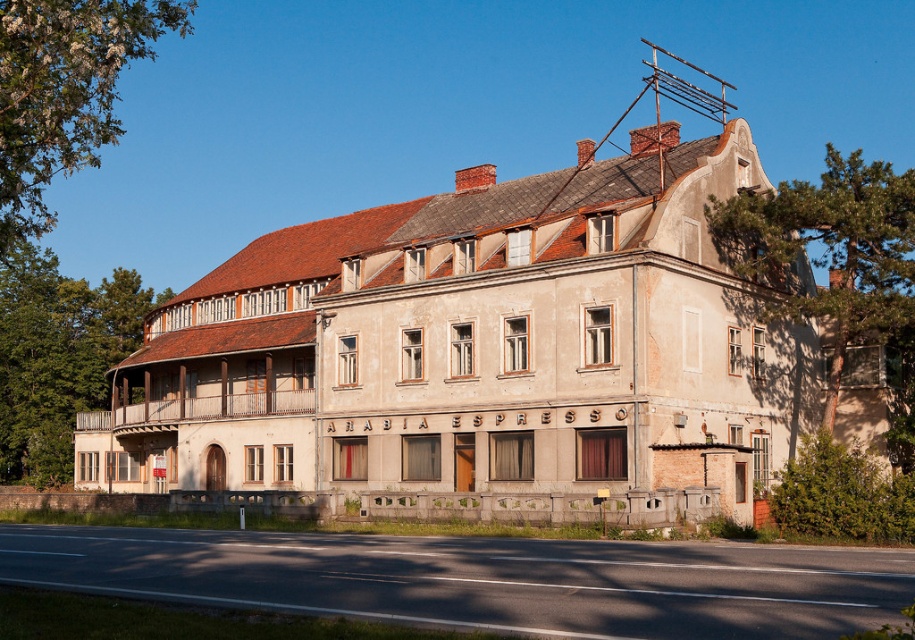
You are standing at the entrance of the ARABIA ESPRESSO on the ground floor. Looking up, you see a point marked at coordinates (835, 262). What object does this point correspond to?

The point at coordinates 0.414, 0.914 corresponds to the green leafy tree at upper right.

You are a customer at the ARABIA ESPRESSO and want to take a photo of the building with both green leafy tree at upper right and green leafy tree at upper left in the frame. Which tree should you position closer to the center of your camera view to include both trees in the photo?

You should position the green leafy tree at upper right closer to the center of your camera view because it is smaller than the green leafy tree at upper left, allowing both to fit within the frame.